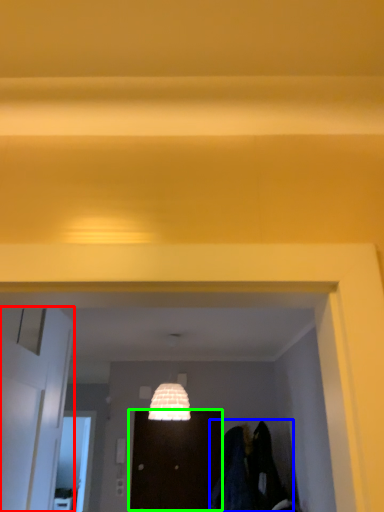
Question: Considering the real-world distances, which object is farthest from door (highlighted by a red box)? laundry (highlighted by a blue box) or door (highlighted by a green box)?

Choices:
 (A) laundry
 (B) door

Answer: (B)